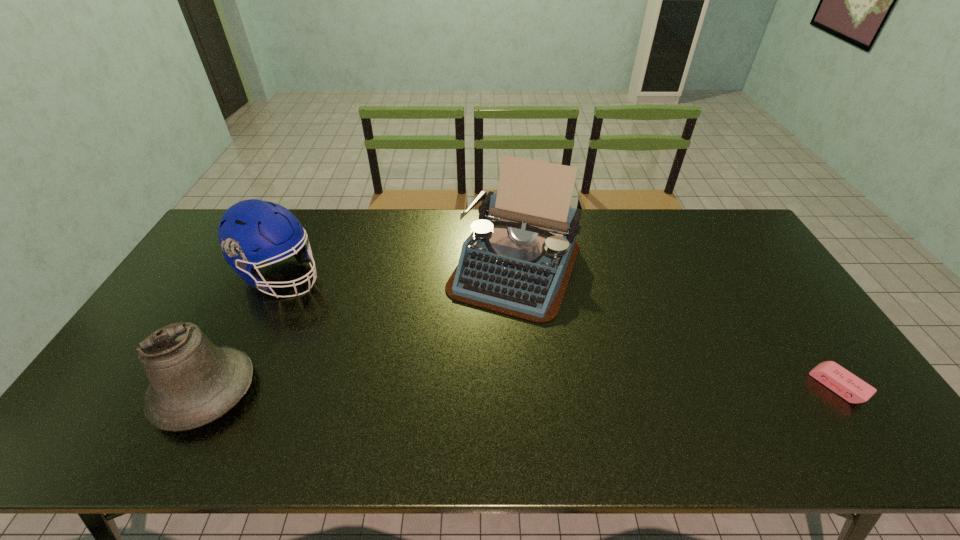
Identify the location of vacant spot on the desktop that is between the bell and the eraser and is positioned on the front-facing side of the football helmet. (488, 389).

Where is `vacant space on the desktop that is between the bell and the shortest object and is positioned on the typing side of the typewriter`? This screenshot has width=960, height=540. vacant space on the desktop that is between the bell and the shortest object and is positioned on the typing side of the typewriter is located at coordinates (458, 389).